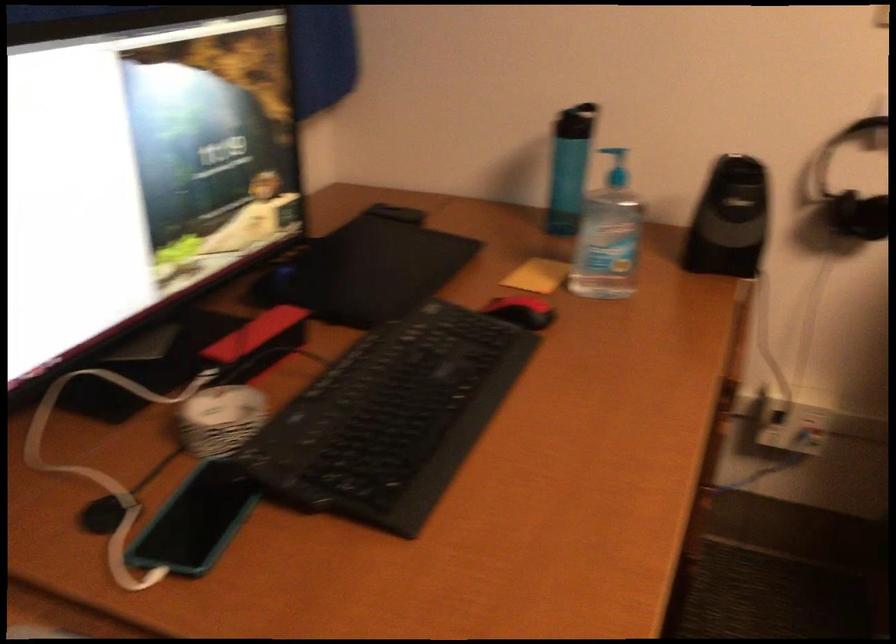
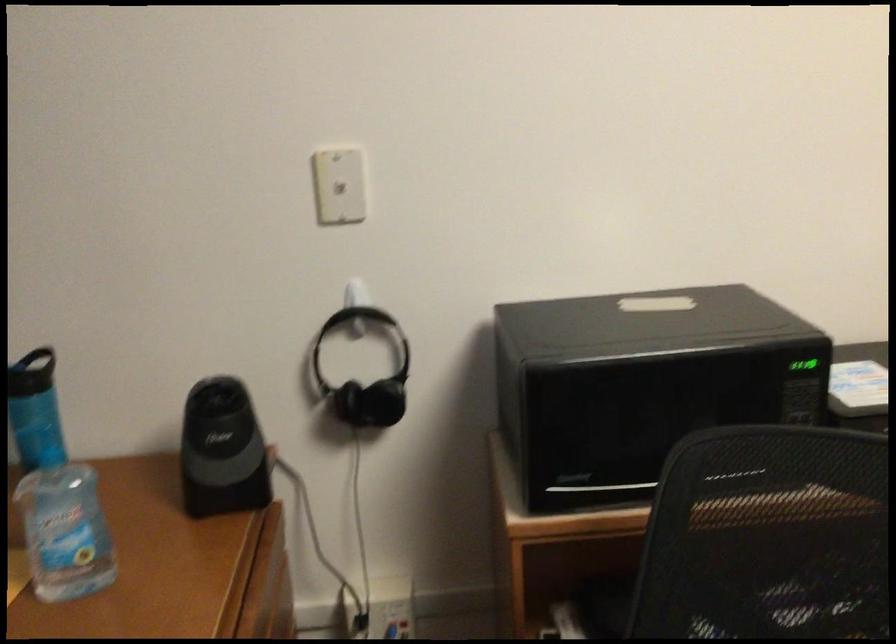
Looking at this image, the images are taken continuously from a first-person perspective. In which direction are you moving?

The movement direction of the cameraman is right, forward.